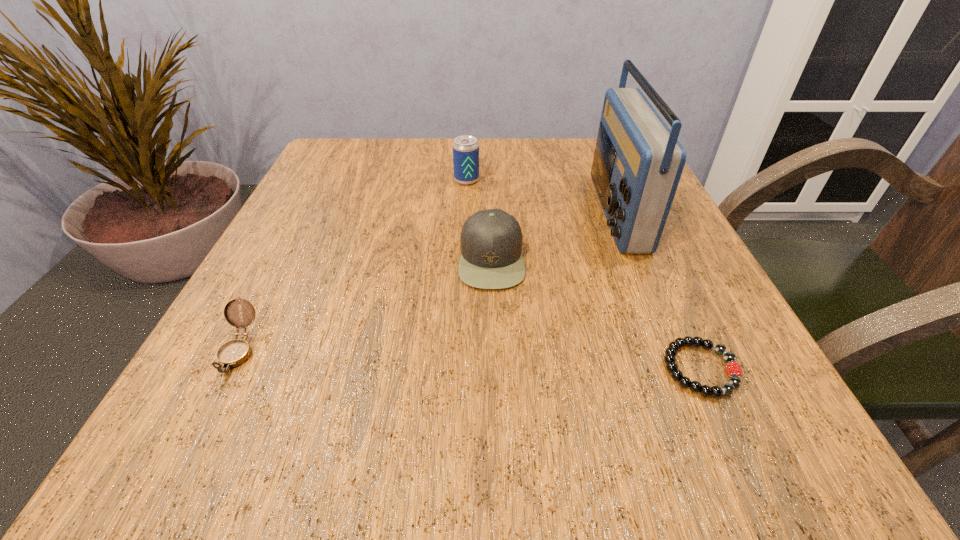
Identify the location of vacant region located 0.220m on the brim of the cap. pos(332,259).

This screenshot has width=960, height=540. What are the coordinates of `free space located on the brim of the cap` in the screenshot? It's located at (308, 259).

Locate an element on the screen. The height and width of the screenshot is (540, 960). free spot located 0.330m on the brim of the cap is located at coordinates (268, 259).

I want to click on vacant space located 0.120m on the face of the leftmost object, so click(176, 474).

At what (x,y) coordinates should I click in order to perform the action: click on vacant position located 0.120m on the left of the bracelet. Please return your answer as a coordinate pair (x, y). Looking at the image, I should click on (575, 369).

Locate an element on the screen. The image size is (960, 540). radio receiver located in the far edge section of the desktop is located at coordinates (638, 161).

Where is `beer can located in the far edge section of the desktop`? beer can located in the far edge section of the desktop is located at coordinates (465, 148).

This screenshot has height=540, width=960. I want to click on object present at the left edge, so click(234, 353).

In order to click on radio receiver that is at the right edge in this screenshot , I will do `click(638, 161)`.

The image size is (960, 540). What are the coordinates of `bracelet that is at the right edge` in the screenshot? It's located at (734, 371).